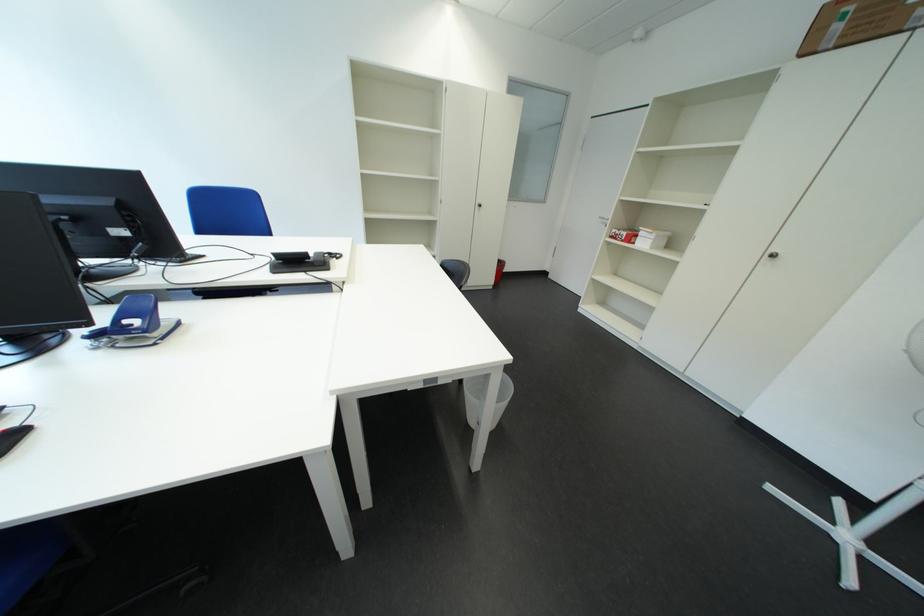
Find the location of a particular element. white door handle is located at coordinates [x=602, y=220].